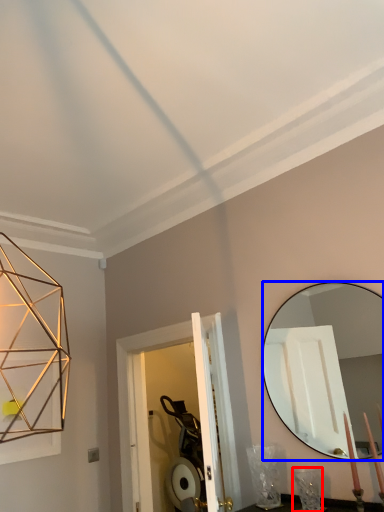
Question: Which object appears farthest to the camera in this image, table lamp (highlighted by a red box) or mirror (highlighted by a blue box)?

Choices:
 (A) table lamp
 (B) mirror

Answer: (A)